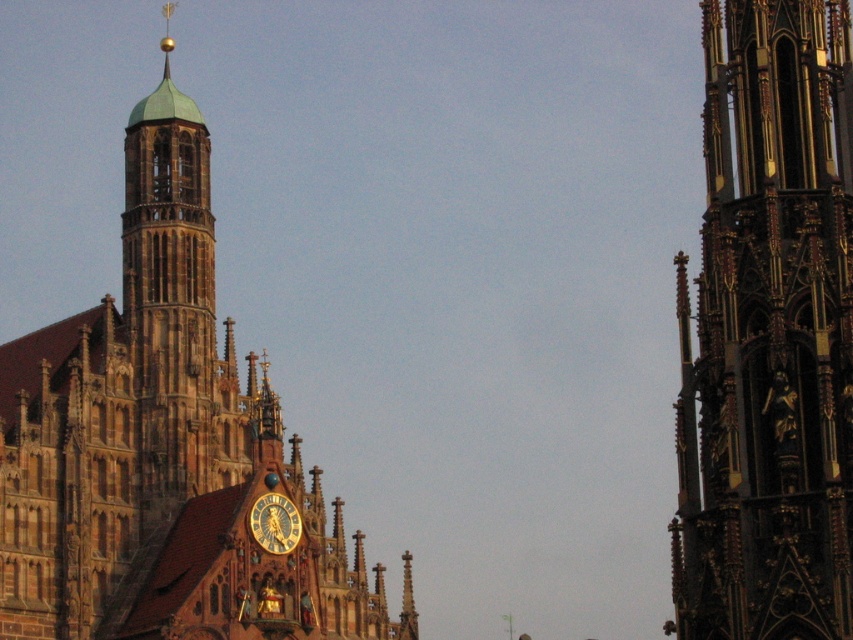
Does point (750, 522) lie behind point (258, 508)?

No, (750, 522) is closer to viewer.

Identify the location of gold/gilded stone tower at right. (769, 333).

Identify the location of gold/gilded stone tower at right. This screenshot has height=640, width=853. (769, 333).

The width and height of the screenshot is (853, 640). Find the location of `gold/gilded stone tower at right`. gold/gilded stone tower at right is located at coordinates (769, 333).

Between point (190, 378) and point (688, 518), which one is positioned in front?

Positioned in front is point (688, 518).

Which is below, brown stone church at center or gold/gilded stone tower at right?

gold/gilded stone tower at right is below.

Between point (106, 417) and point (766, 248), which one is positioned behind?

The point (106, 417) is more distant.

The width and height of the screenshot is (853, 640). I want to click on brown stone church at center, so click(x=163, y=445).

Which of these two, brown stone church at center or gold metallic clock at center, stands shorter?

gold metallic clock at center

Which is in front, point (231, 572) or point (277, 548)?

Point (231, 572) is more forward.

Who is more distant from viewer, (202,464) or (256,525)?

Point (202,464)

You are a GUI agent. You are given a task and a screenshot of the screen. Output one action in this format:
    pyautogui.click(x=<x>, y=<y>)
    Task: Click on the brown stone church at center
    
    Given the screenshot: What is the action you would take?
    pyautogui.click(x=163, y=445)